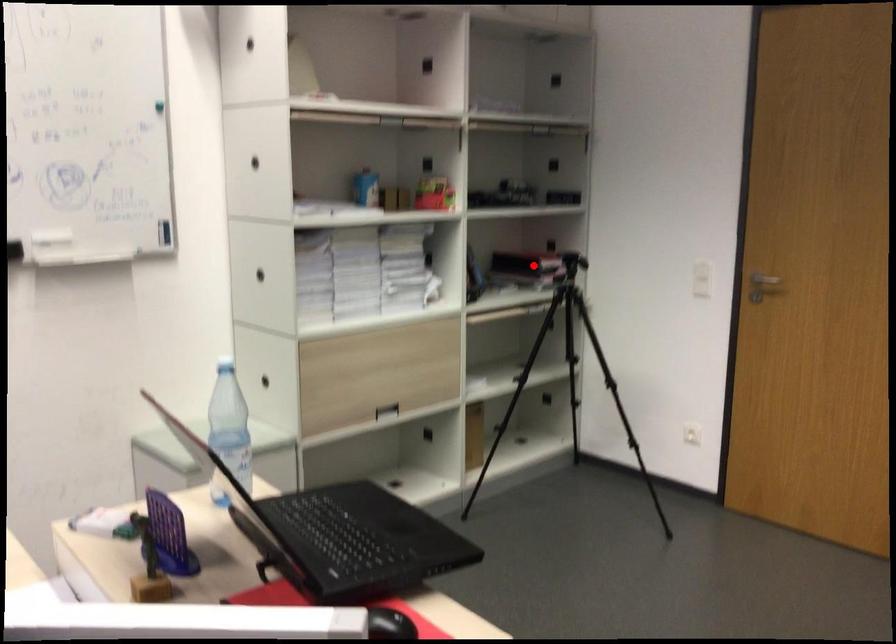
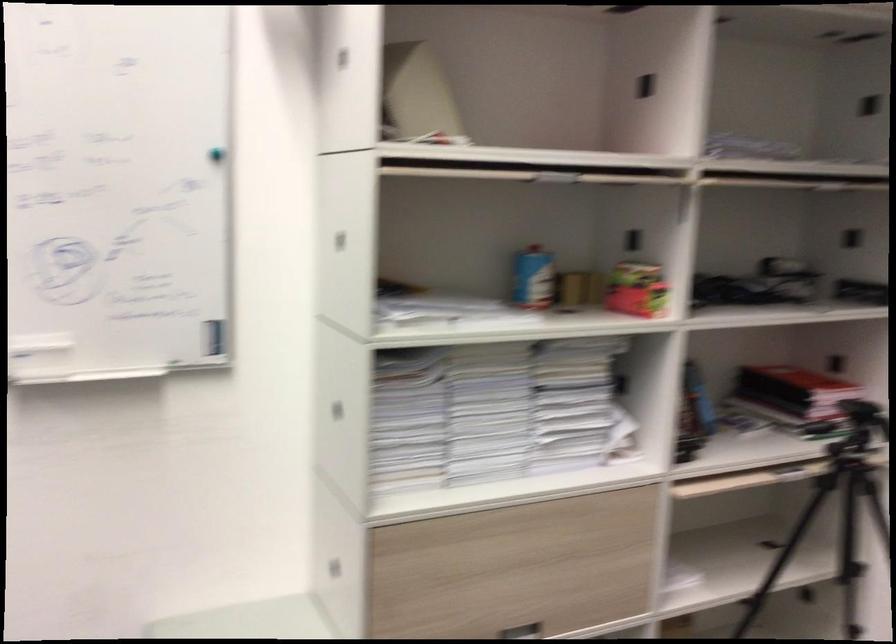
The point at the highlighted location is marked in the first image. Where is the corresponding point in the second image?

(793, 398)